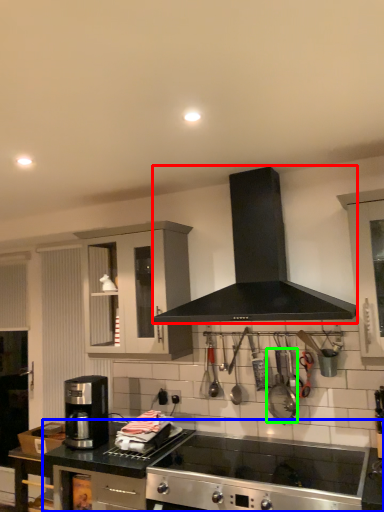
Question: Which object is positioned farthest from kitchen appliance (highlighted by a red box)? Select from countertop (highlighted by a blue box) and appliance (highlighted by a green box).

Choices:
 (A) countertop
 (B) appliance

Answer: (A)